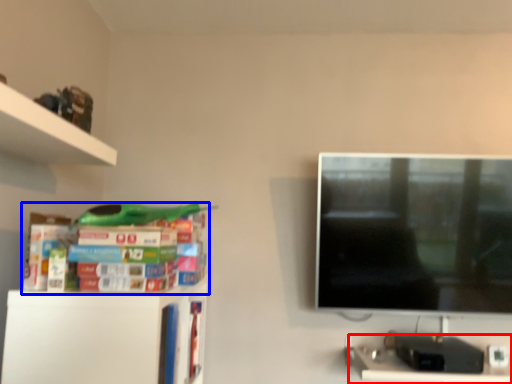
Question: Which of the following is the farthest to the observer, computer desk (highlighted by a red box) or book (highlighted by a blue box)?

Choices:
 (A) computer desk
 (B) book

Answer: (A)